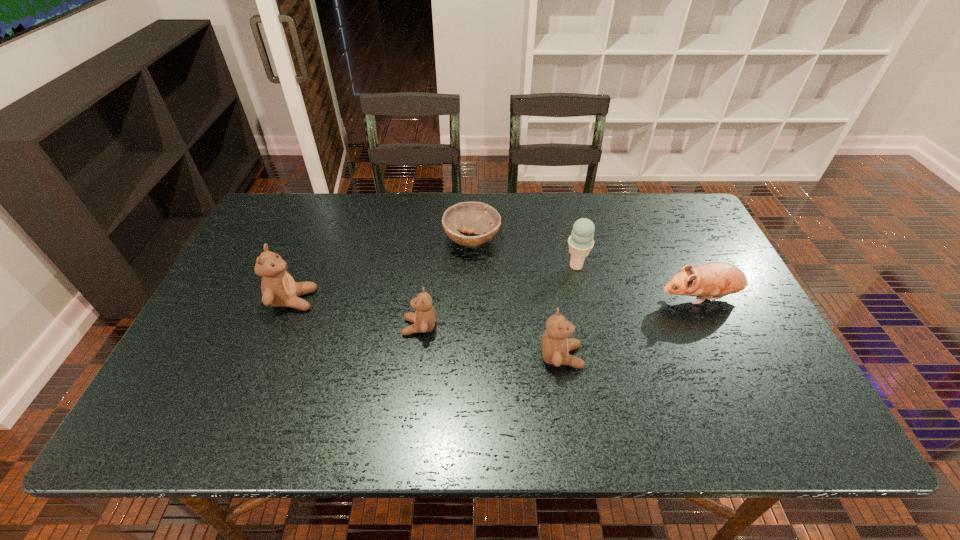
You are a GUI agent. You are given a task and a screenshot of the screen. Output one action in this format:
    pyautogui.click(x=<x>, y=<y>)
    Task: Click on the object that is at the left edge
    The height and width of the screenshot is (540, 960).
    Given the screenshot: What is the action you would take?
    (x=279, y=289)

Image resolution: width=960 pixels, height=540 pixels. I want to click on object positioned at the right edge, so tap(714, 280).

This screenshot has width=960, height=540. I want to click on free space at the far edge, so click(509, 199).

You are a GUI agent. You are given a task and a screenshot of the screen. Output one action in this format:
    pyautogui.click(x=<x>, y=<y>)
    Task: Click on the vacant space at the near edge of the desktop
    Image resolution: width=960 pixels, height=540 pixels.
    Given the screenshot: What is the action you would take?
    pyautogui.click(x=391, y=374)

The image size is (960, 540). I want to click on blank space at the left edge of the desktop, so click(237, 275).

The width and height of the screenshot is (960, 540). Find the location of `free spot at the right edge of the desktop`. free spot at the right edge of the desktop is located at coordinates (669, 267).

The height and width of the screenshot is (540, 960). In the image, there is a desktop. What are the coordinates of `blank space at the far right corner` in the screenshot? It's located at (651, 208).

What are the coordinates of `free space between the ice cream and the second object from left to right` in the screenshot? It's located at click(x=498, y=296).

This screenshot has width=960, height=540. Identify the location of free spot between the rightmost object and the second tallest teddy bear. (631, 327).

The image size is (960, 540). Find the location of `vacant point located between the hamster and the second teddy bear from right to left`. vacant point located between the hamster and the second teddy bear from right to left is located at coordinates (560, 313).